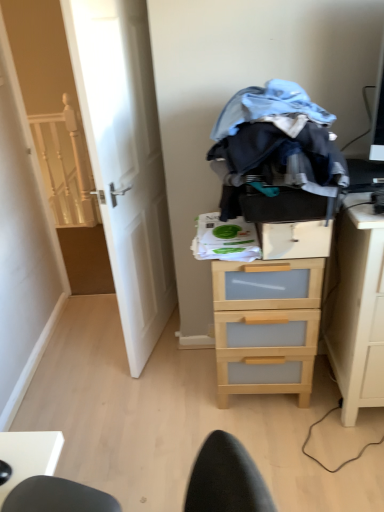
At what (x,y) coordinates should I click in order to perform the action: click on vacant area that is in front of light wood/transparent drawer at center. Please return your answer as a coordinate pair (x, y). Image resolution: width=384 pixels, height=512 pixels. Looking at the image, I should click on (299, 450).